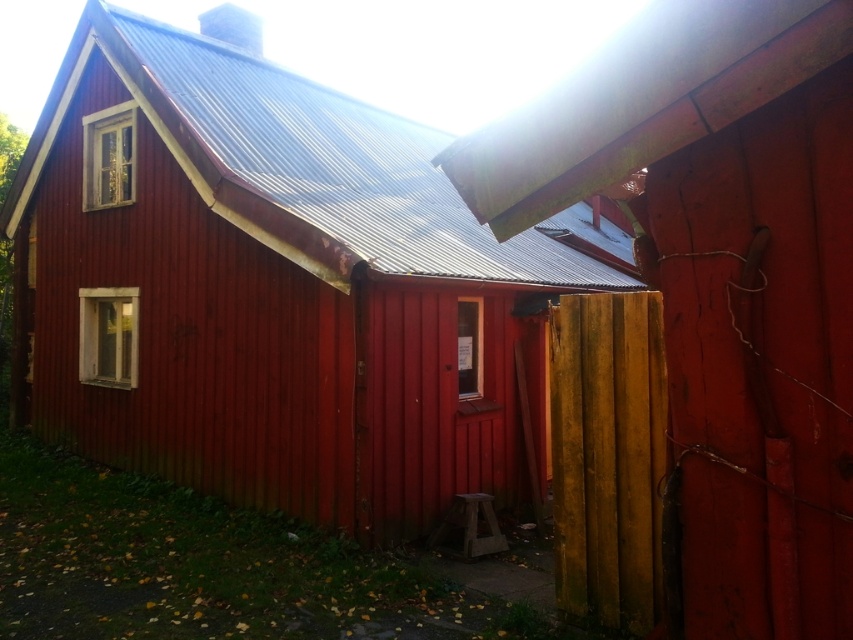
Where is `wooden planks at right`? The height and width of the screenshot is (640, 853). wooden planks at right is located at coordinates (721, 282).

Between wooden planks at right and yellow wood fence at right, which one is positioned lower?

yellow wood fence at right is lower down.

At what (x,y) coordinates should I click in order to perform the action: click on wooden planks at right. Please return your answer as a coordinate pair (x, y). Looking at the image, I should click on (721, 282).

Does smooth wooden cabin at center have a greater width compared to yellow wood fence at right?

Indeed, smooth wooden cabin at center has a greater width compared to yellow wood fence at right.

Which is behind, point (285, 112) or point (622, 358)?

Point (285, 112)

Between point (474, 486) and point (630, 413), which one is positioned in front?

Point (630, 413) is more forward.

The image size is (853, 640). Identify the location of smooth wooden cabin at center. (271, 288).

Is smooth wooden cabin at center above wooden planks at right?

Yes, smooth wooden cabin at center is above wooden planks at right.

Is smooth wooden cabin at center bigger than wooden planks at right?

Indeed, smooth wooden cabin at center has a larger size compared to wooden planks at right.

This screenshot has width=853, height=640. Describe the element at coordinates (271, 288) in the screenshot. I see `smooth wooden cabin at center` at that location.

The width and height of the screenshot is (853, 640). What are the coordinates of `smooth wooden cabin at center` in the screenshot? It's located at (271, 288).